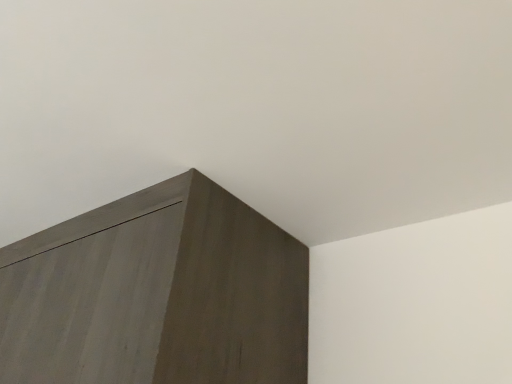
Find the location of a particular element. The width and height of the screenshot is (512, 384). dark wood cabinet at lower left is located at coordinates (257, 108).

Image resolution: width=512 pixels, height=384 pixels. Describe the element at coordinates (257, 108) in the screenshot. I see `dark wood cabinet at lower left` at that location.

The image size is (512, 384). I want to click on dark wood cabinet at lower left, so click(257, 108).